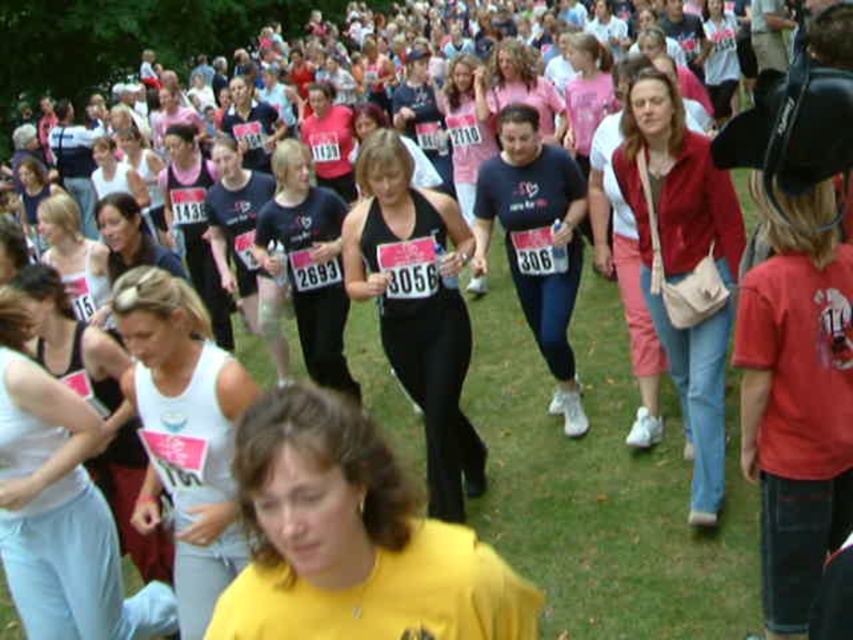
Question: Can you confirm if yellow matte shirt at center is smaller than white matte tank top at center?

Choices:
 (A) yes
 (B) no

Answer: (A)

Question: Can you confirm if yellow matte shirt at center is smaller than pink fabric tank top at center?

Choices:
 (A) no
 (B) yes

Answer: (B)

Question: Can you confirm if white matte tank top at center is positioned to the left of matte black tank top at center?

Choices:
 (A) no
 (B) yes

Answer: (B)

Question: Which point appears farthest from the camera in this image?

Choices:
 (A) (461, 429)
 (B) (331, 548)

Answer: (A)

Question: Which object appears farthest from the camera in this image?

Choices:
 (A) matte black tank top at center
 (B) white matte tank top at center
 (C) yellow matte shirt at center

Answer: (A)

Question: Which point is farther to the camera?

Choices:
 (A) pink fabric tank top at center
 (B) velvet red jacket at center
 (C) matte black tank top at center
 (D) white matte tank top at center

Answer: (A)